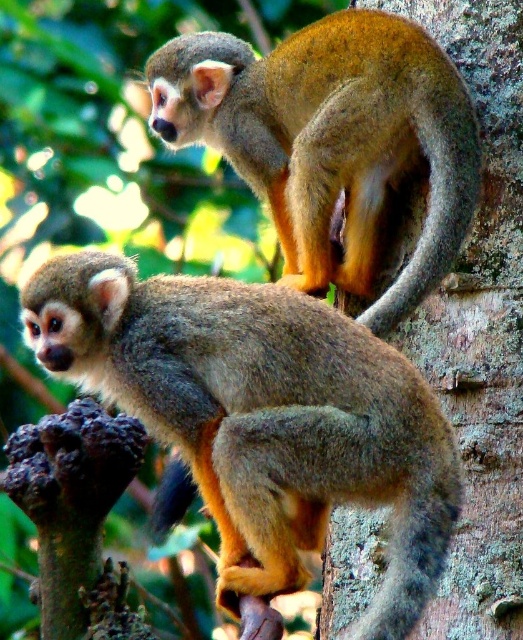
Is brown furry monkey at lower left wider than golden fur monkey at upper center?

Yes, brown furry monkey at lower left is wider than golden fur monkey at upper center.

How distant is brown furry monkey at lower left from golden fur monkey at upper center?

55.62 centimeters

Between point (84, 358) and point (349, 12), which one is positioned in front?

Positioned in front is point (84, 358).

The height and width of the screenshot is (640, 523). What are the coordinates of `brown furry monkey at lower left` in the screenshot? It's located at (262, 417).